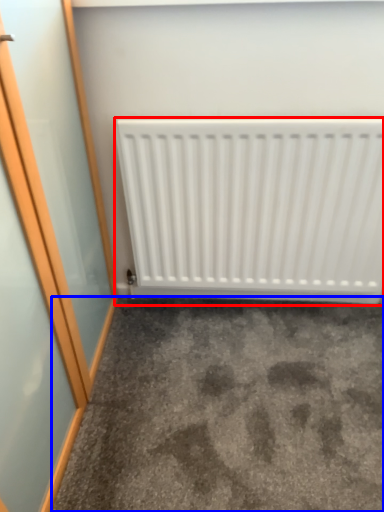
Question: Which object is closer to the camera taking this photo, radiator (highlighted by a red box) or concrete (highlighted by a blue box)?

Choices:
 (A) radiator
 (B) concrete

Answer: (B)